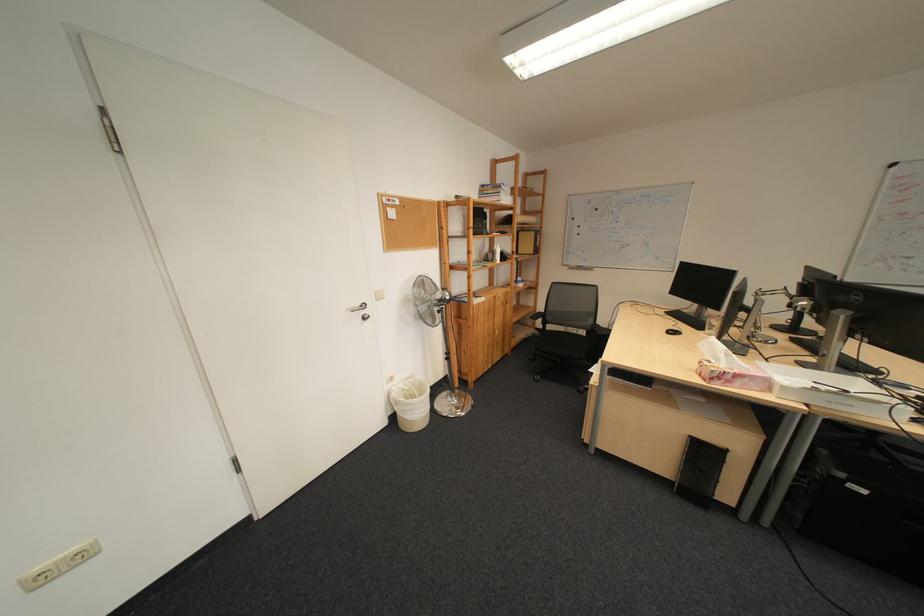
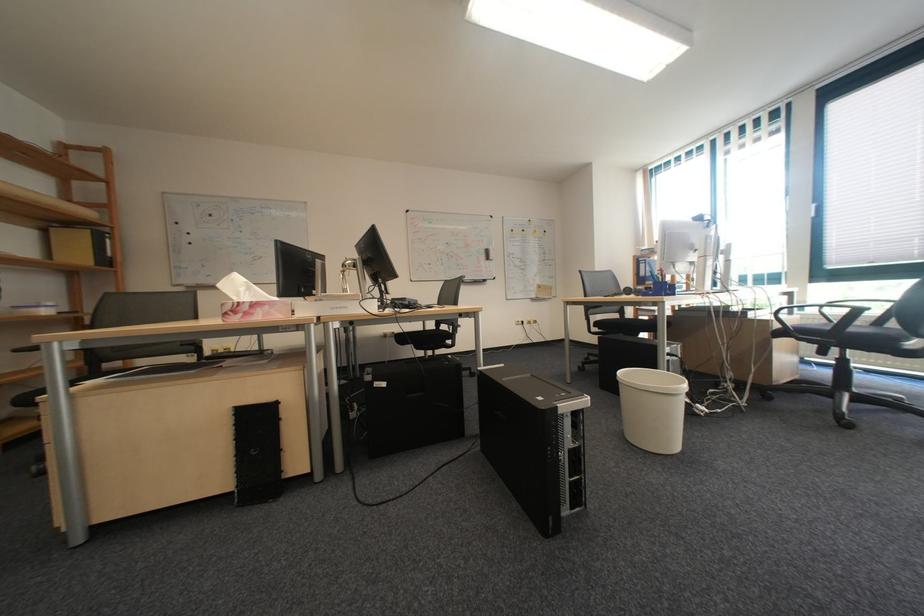
The point at (879, 493) is marked in the first image. Where is the corresponding point in the second image?

(398, 386)